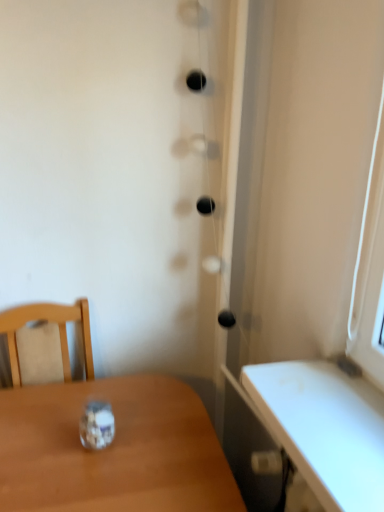
You are a GUI agent. You are given a task and a screenshot of the screen. Output one action in this format:
    pyautogui.click(x=<x>, y=<y>)
    Task: Click on the vacant space in front of clear glass jar at center
    
    Given the screenshot: What is the action you would take?
    pyautogui.click(x=81, y=484)